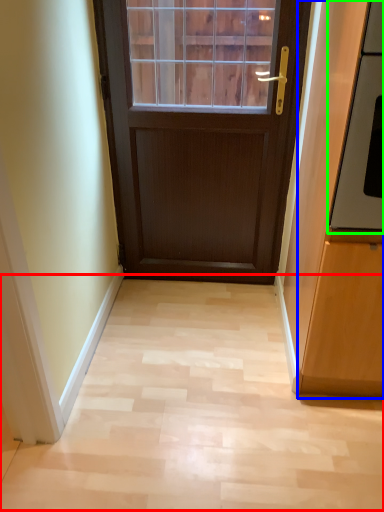
Question: Estimate the real-world distances between objects in this image. Which object is farther from corridor (highlighted by a red box), cabinetry (highlighted by a blue box) or oven (highlighted by a green box)?

Choices:
 (A) cabinetry
 (B) oven

Answer: (B)